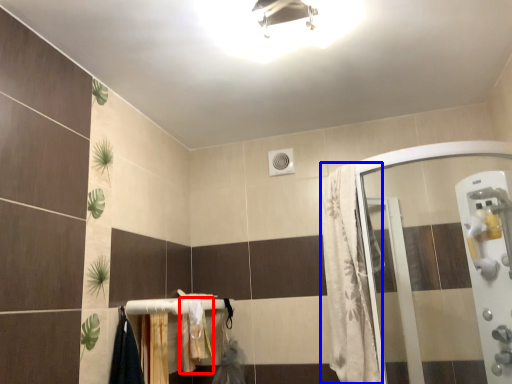
Question: Among these objects, which one is farthest to the camera, bath towel (highlighted by a red box) or shower curtain (highlighted by a blue box)?

Choices:
 (A) bath towel
 (B) shower curtain

Answer: (A)